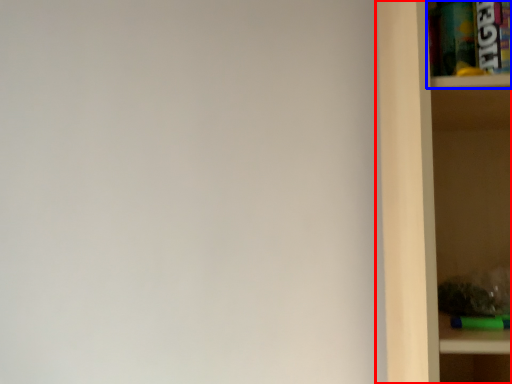
Question: Which point is further to the camera, shelf (highlighted by a red box) or cabinet (highlighted by a blue box)?

Choices:
 (A) shelf
 (B) cabinet

Answer: (B)